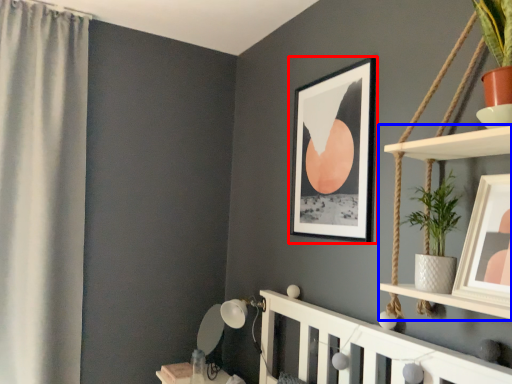
Question: Among these objects, which one is farthest to the camera, picture frame (highlighted by a red box) or shelf (highlighted by a blue box)?

Choices:
 (A) picture frame
 (B) shelf

Answer: (A)